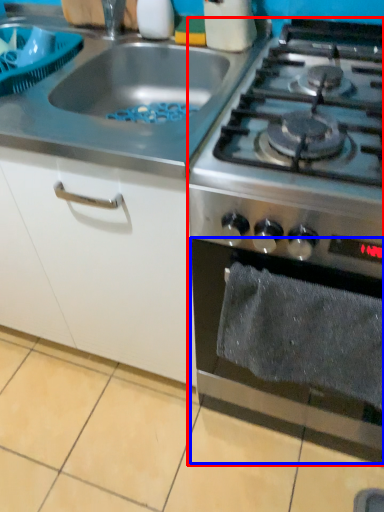
Question: Which object is further to the camera taking this photo, gas stove (highlighted by a red box) or oven (highlighted by a blue box)?

Choices:
 (A) gas stove
 (B) oven

Answer: (A)